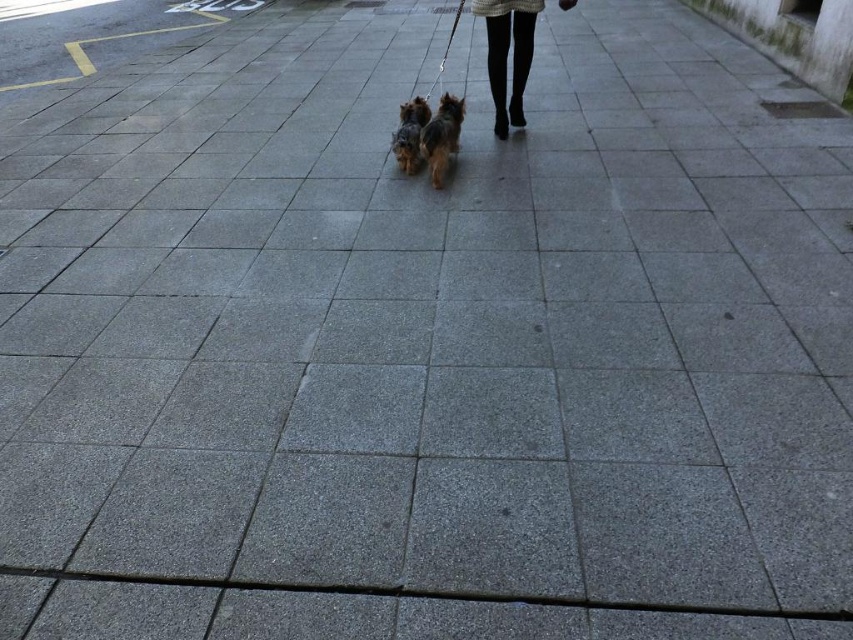
Question: Based on their relative distances, which object is farther from the black tights at center?

Choices:
 (A) short-haired brown dog at center
 (B) shaggy brown dog at center

Answer: (B)

Question: Is black tights at center wider than shaggy brown dog at center?

Choices:
 (A) no
 (B) yes

Answer: (B)

Question: Which point is closer to the camera taking this photo?

Choices:
 (A) (511, 28)
 (B) (424, 140)

Answer: (B)

Question: Is black tights at center to the right of shaggy brown dog at center from the viewer's perspective?

Choices:
 (A) no
 (B) yes

Answer: (B)

Question: Which point is closer to the camera?

Choices:
 (A) short-haired brown dog at center
 (B) black tights at center

Answer: (A)

Question: Where is black tights at center located in relation to shaggy brown dog at center in the image?

Choices:
 (A) right
 (B) left

Answer: (A)